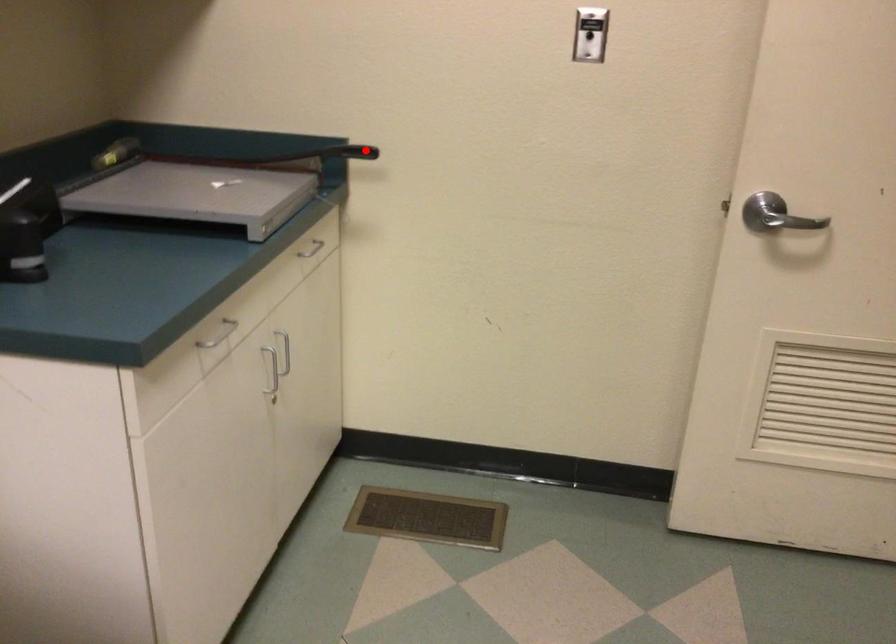
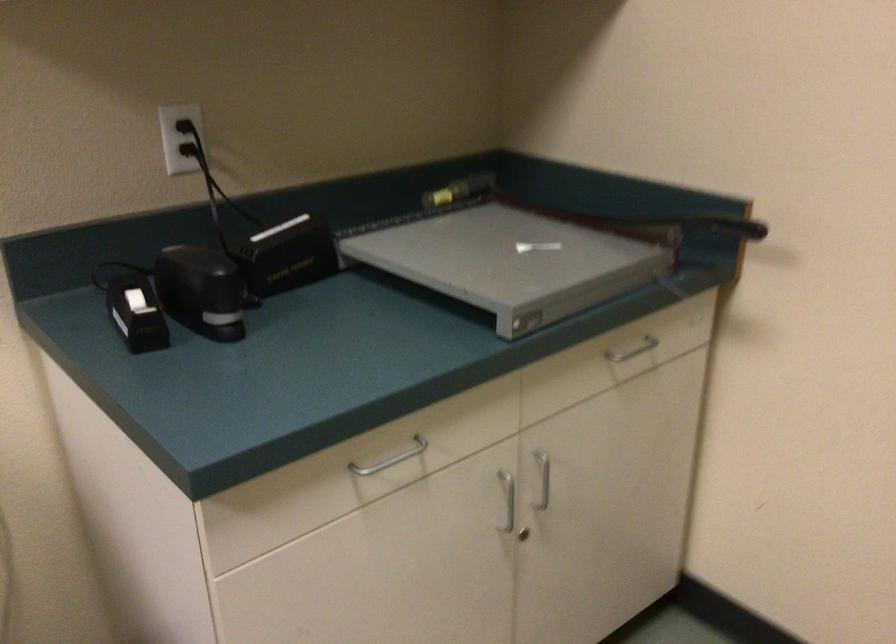
Question: I am providing you with two images of the same scene from different viewpoints. A red point is shown in image1. For the corresponding object point in image2, is it positioned nearer or farther from the camera?

Choices:
 (A) Nearer
 (B) Farther

Answer: (A)